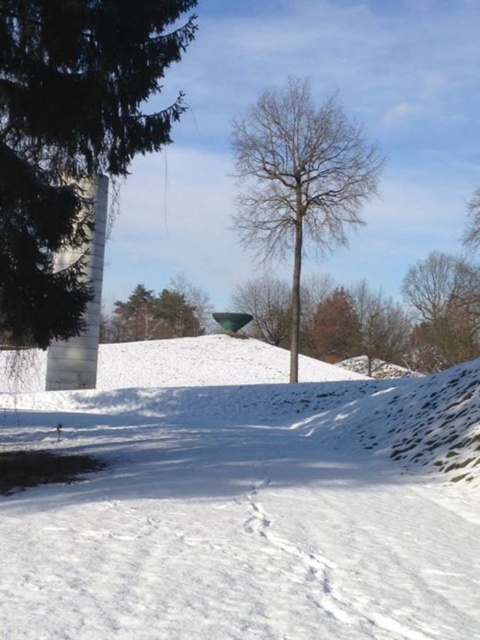
You are standing at the point labeled as point (242, 499) in the winter scene. Looking around, you see a large evergreen tree on the left and a tall deciduous tree on the right. Which direction should you walk to reach the large evergreen tree?

You should walk to the left to reach the large evergreen tree on the left since the point is located at the center of the white snow, and the evergreen tree is on the left side of the image.

You are an observer standing in the winter scene. You notice the white snow at center and the green matte tree at left. Which of these two objects is wider in terms of their horizontal spread?

The white snow at center is wider than the green matte tree at left because its width surpasses the tree.

You are standing at the center of the winter scene and want to locate the bare wood tree at center. What are the coordinates where you should look?

The coordinates to locate the bare wood tree at center are at point (300, 179).